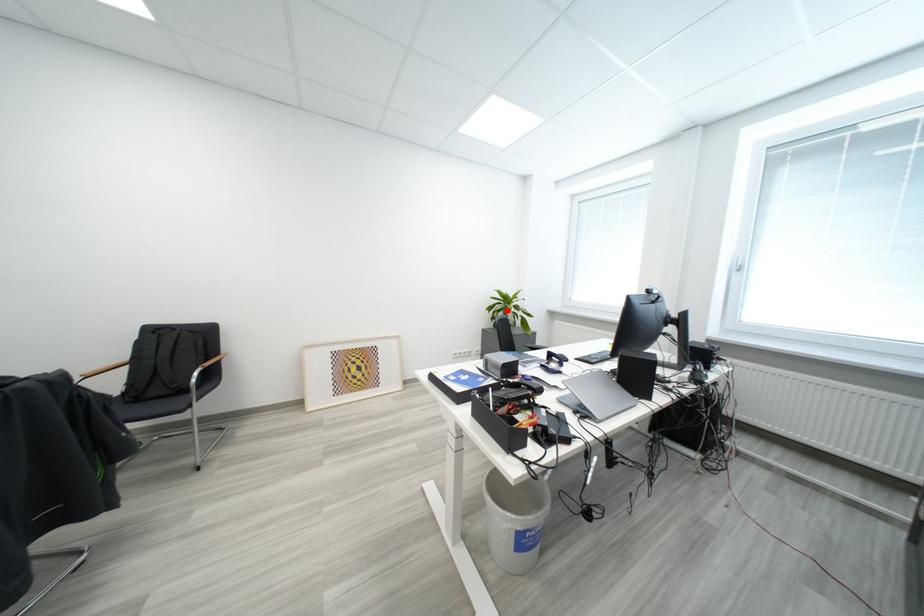
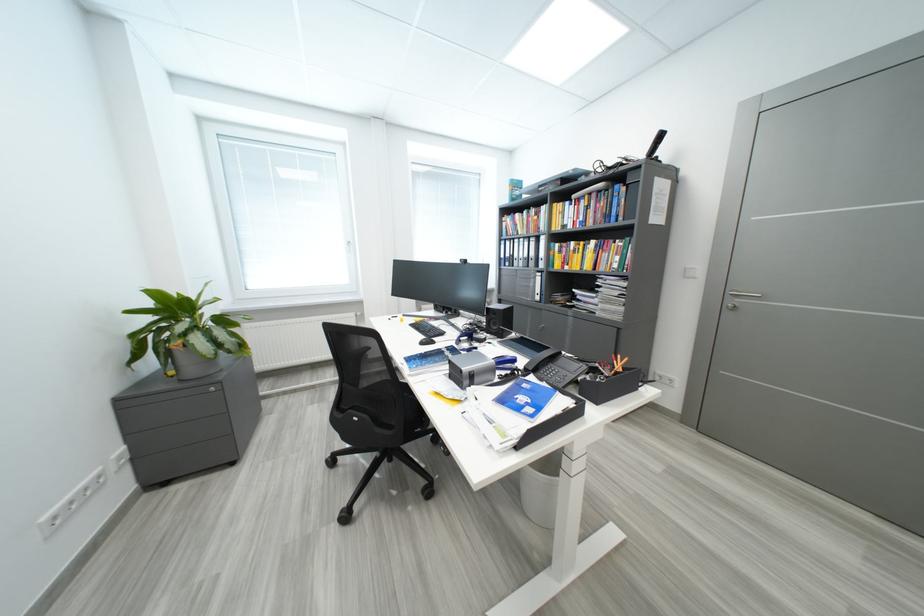
Locate, in the second image, the point that corresponds to the highlighted location in the first image.

(189, 331)